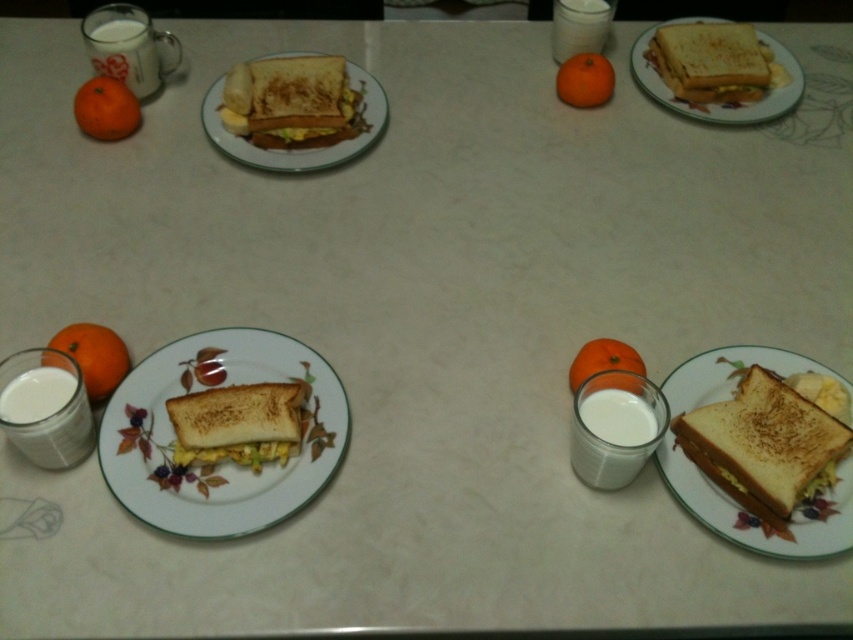
Is matte white plate at lower right below orange matte at upper center?

Indeed, matte white plate at lower right is positioned under orange matte at upper center.

The height and width of the screenshot is (640, 853). What do you see at coordinates (755, 522) in the screenshot?
I see `matte white plate at lower right` at bounding box center [755, 522].

Is point (666, 378) positioned behind point (602, 92)?

No, it is not.

At what (x,y) coordinates should I click in order to perform the action: click on matte white plate at lower right. Please return your answer as a coordinate pair (x, y). This screenshot has width=853, height=640. Looking at the image, I should click on (755, 522).

From the picture: Can you confirm if orange matte at left is taller than orange matte at upper center?

Yes, orange matte at left is taller than orange matte at upper center.

Which of these two, orange matte at left or orange matte at upper center, stands shorter?

With less height is orange matte at upper center.

Who is more forward, (84,360) or (596,61)?

Point (84,360) is more forward.

Identify the location of orange matte at left. (94, 355).

Who is taller, matte white plate at lower right or white opaque glass at upper center?

With more height is matte white plate at lower right.

Between matte white plate at lower right and white opaque glass at upper center, which one is positioned higher?

Positioned higher is white opaque glass at upper center.

Image resolution: width=853 pixels, height=640 pixels. What do you see at coordinates (755, 522) in the screenshot?
I see `matte white plate at lower right` at bounding box center [755, 522].

At what (x,y) coordinates should I click in order to perform the action: click on matte white plate at lower right. Please return your answer as a coordinate pair (x, y). The height and width of the screenshot is (640, 853). Looking at the image, I should click on (755, 522).